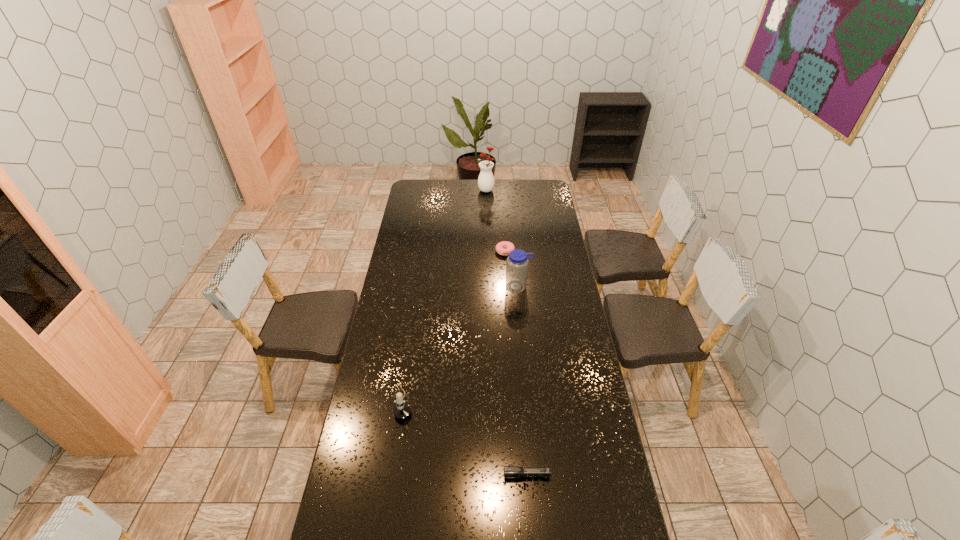
At what (x,y) coordinates should I click in order to perform the action: click on vacant point located 0.180m on the back of the microphone. Please return your answer as a coordinate pair (x, y). Looking at the image, I should click on (412, 348).

Locate an element on the screen. This screenshot has height=540, width=960. free space located on the back of the doughnut is located at coordinates (503, 227).

Find the location of a particular element. The width and height of the screenshot is (960, 540). free space located 0.260m at the lens end of the flashlight is located at coordinates (424, 475).

Locate an element on the screen. vacant space located at the lens end of the flashlight is located at coordinates (410, 475).

Where is `free space located 0.390m at the lens end of the flashlight`? The height and width of the screenshot is (540, 960). free space located 0.390m at the lens end of the flashlight is located at coordinates (385, 475).

Locate an element on the screen. object at the far edge is located at coordinates (486, 179).

Locate an element on the screen. The image size is (960, 540). object that is at the left edge is located at coordinates (402, 410).

Find the location of a particular element. The height and width of the screenshot is (540, 960). vacant space at the far edge of the desktop is located at coordinates (465, 183).

Locate an element on the screen. vacant space at the left edge of the desktop is located at coordinates pyautogui.click(x=429, y=210).

This screenshot has height=540, width=960. In order to click on free region at the right edge of the desktop in this screenshot , I will do `click(562, 239)`.